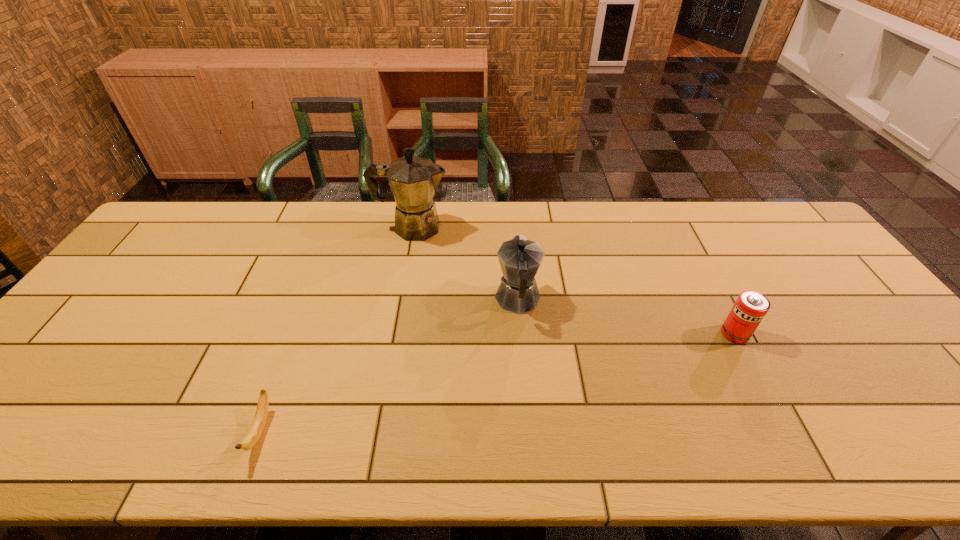
Identify the location of free space between the nearest object and the second object from right to left. (389, 366).

Identify the location of free space between the nearest object and the second object from right to left. (389, 366).

Locate an element on the screen. vacant space that's between the second object from right to left and the farther coffeepot is located at coordinates (465, 264).

At what (x,y) coordinates should I click in order to perform the action: click on vacant space that is in between the rightmost object and the leftmost object. Please return your answer as a coordinate pair (x, y). Looking at the image, I should click on (497, 382).

Locate an element on the screen. This screenshot has width=960, height=540. vacant point located between the rightmost object and the left coffeepot is located at coordinates (573, 281).

Find the location of a particular element. Image resolution: width=960 pixels, height=540 pixels. vacant area that lies between the rightmost object and the second object from right to left is located at coordinates (626, 317).

This screenshot has height=540, width=960. I want to click on empty space that is in between the nearest object and the tallest object, so click(x=336, y=329).

Identify the location of blank region between the nearer coffeepot and the rightmost object. (626, 317).

Where is `free spot between the rightmost object and the tallest object`? The height and width of the screenshot is (540, 960). free spot between the rightmost object and the tallest object is located at coordinates (573, 281).

Locate which object is the second closest to the third tallest object. Please provide its 2D coordinates. Your answer should be formatted as a tuple, i.e. [(x, y)], where the tuple contains the x and y coordinates of a point satisfying the conditions above.

[(413, 180)]